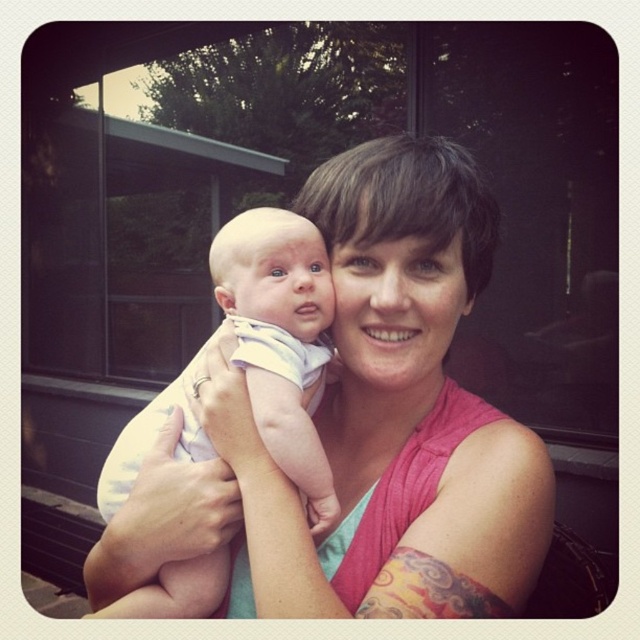
Looking at this image, can you confirm if pink fabric tank top at center is bigger than light blue cotton onesie at center?

Indeed, pink fabric tank top at center has a larger size compared to light blue cotton onesie at center.

Identify the location of pink fabric tank top at center. (362, 428).